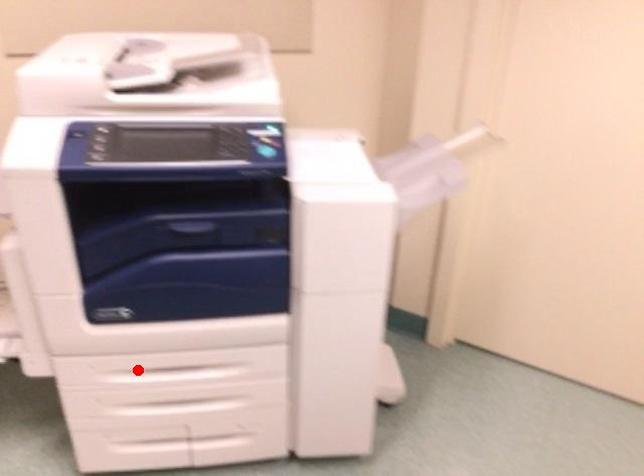
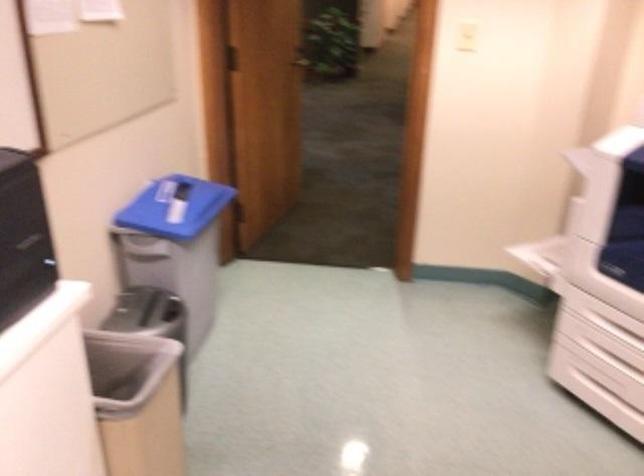
In the second image, find the point that corresponds to the highlighted location in the first image.

(618, 330)